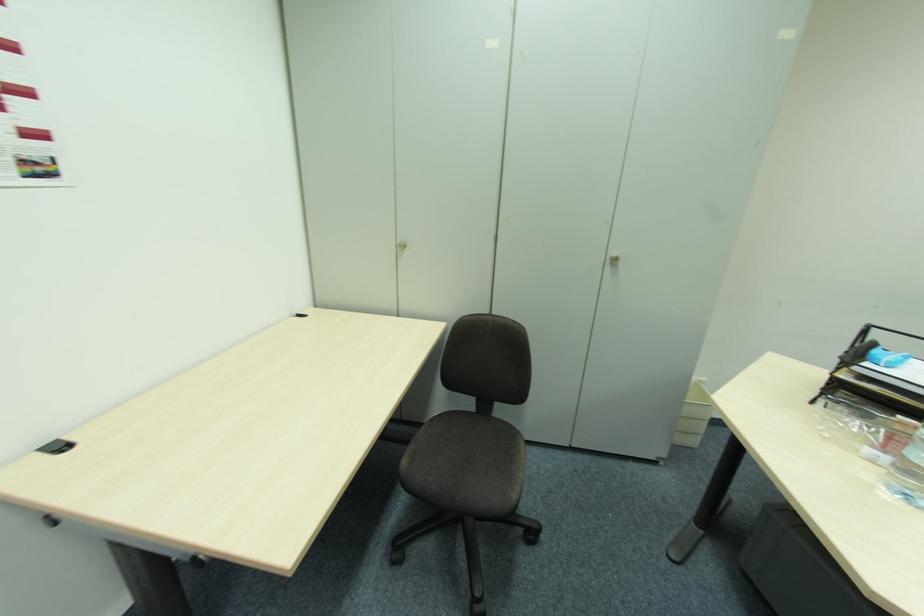
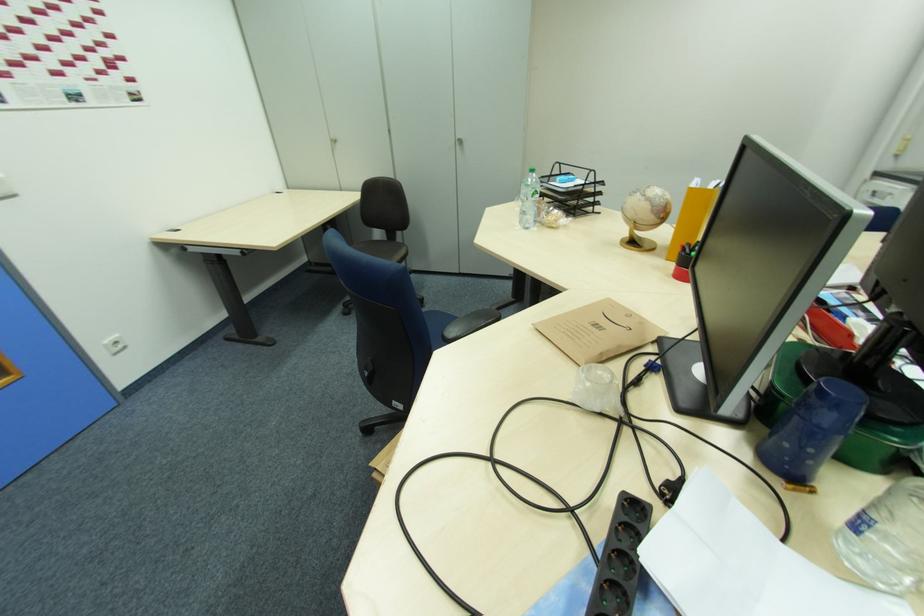
Which direction would the cameraman need to move to produce the second image?

The cameraman walked toward right, backward.